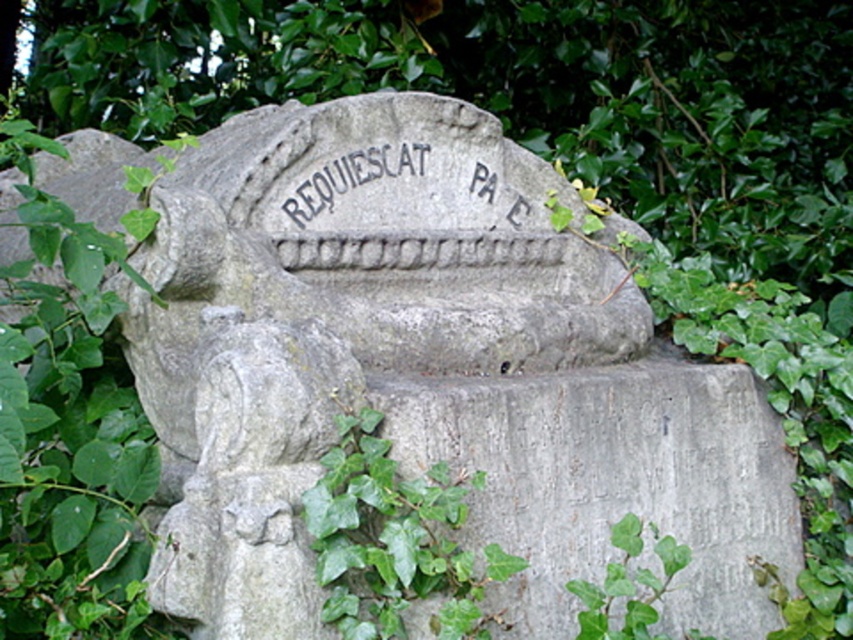
You are standing 2 meters away from a point marked at coordinates (433, 465) on the monument. Can you safely step forward to reach that point without getting too close?

The distance between you and the point marked at coordinates (433, 465) is 2.26 meters. Since you are only 2 meters away, you are already closer than the stated distance, so stepping forward might bring you too near.

Looking at this image, you are a gardener assessing the growth of ivy on a monument. You notice two patches of green leafy ivy at lower center and green leafy ivy at lower right. Which ivy patch is wider?

The green leafy ivy at lower center is wider than the green leafy ivy at lower right.